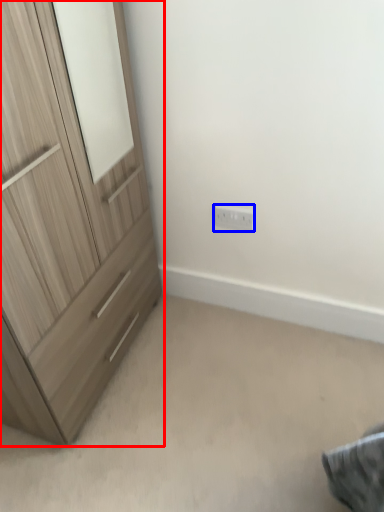
Question: Which of the following is the closest to the observer, chest of drawers (highlighted by a red box) or electric outlet (highlighted by a blue box)?

Choices:
 (A) chest of drawers
 (B) electric outlet

Answer: (A)